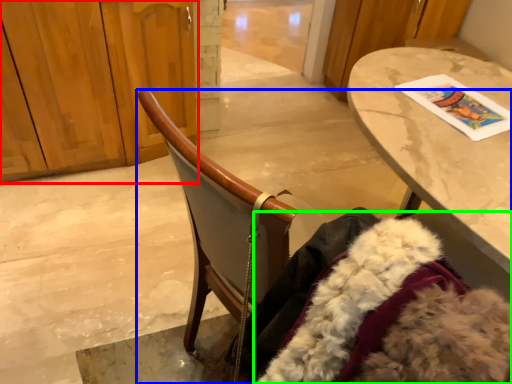
Question: Estimate the real-world distances between objects in this image. Which object is farther from dresser (highlighted by a red box), chair (highlighted by a blue box) or fur coat (highlighted by a green box)?

Choices:
 (A) chair
 (B) fur coat

Answer: (B)